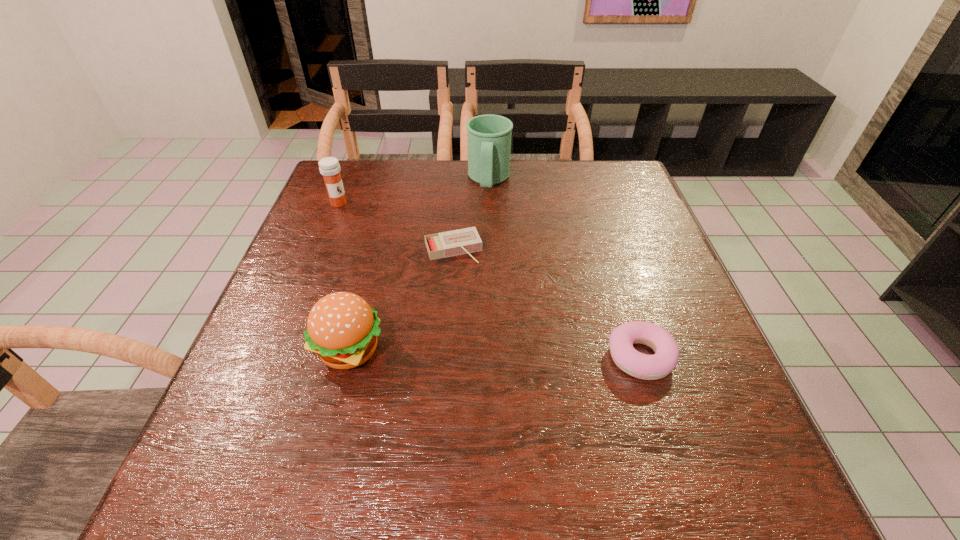
Where is `vacant area situated on the striking surface of the matchbox`? This screenshot has width=960, height=540. vacant area situated on the striking surface of the matchbox is located at coordinates (493, 346).

Find the location of a particular element. free region located on the striking surface of the matchbox is located at coordinates (479, 309).

I want to click on vacant area situated on the label side of the leftmost object, so click(409, 266).

Identify the location of vacant space situated 0.360m on the label side of the leftmost object. (421, 277).

At what (x,y) coordinates should I click in order to perform the action: click on free space located 0.090m on the label side of the leftmost object. Please return your answer as a coordinate pair (x, y). Looking at the image, I should click on (361, 222).

Locate an element on the screen. vacant area situated 0.050m on the side of the mug with the handle is located at coordinates (487, 210).

The height and width of the screenshot is (540, 960). I want to click on vacant space located 0.270m on the side of the mug with the handle, so click(x=480, y=264).

Find the location of a particular element. blank space located 0.050m on the side of the mug with the handle is located at coordinates (487, 210).

Find the location of `medicine that is at the far edge`. medicine that is at the far edge is located at coordinates (329, 167).

Image resolution: width=960 pixels, height=540 pixels. What are the coordinates of `mug located at the far edge` in the screenshot? It's located at (489, 136).